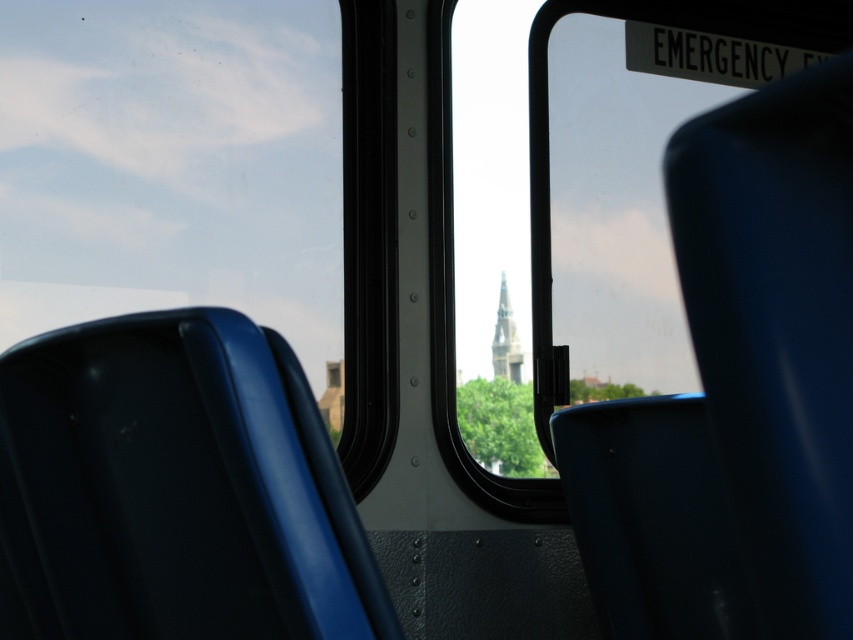
Question: Which point is farther from the camera taking this photo?

Choices:
 (A) 521,376
 (B) 302,637

Answer: (A)

Question: Can you confirm if matte blue chair at center is bigger than smooth gray stone tower at center?

Choices:
 (A) no
 (B) yes

Answer: (B)

Question: Can you confirm if matte blue chair at center is positioned to the left of smooth gray stone tower at center?

Choices:
 (A) no
 (B) yes

Answer: (B)

Question: Which point is closer to the camera?

Choices:
 (A) smooth gray stone tower at center
 (B) matte blue chair at center

Answer: (B)

Question: Does matte blue chair at center appear on the left side of smooth gray stone tower at center?

Choices:
 (A) yes
 (B) no

Answer: (A)